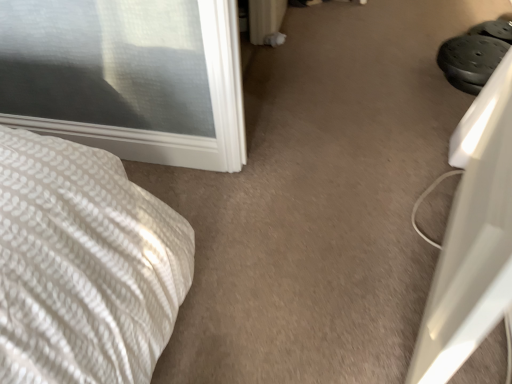
The width and height of the screenshot is (512, 384). Describe the element at coordinates (473, 240) in the screenshot. I see `white glossy screen door at right` at that location.

This screenshot has height=384, width=512. What are the coordinates of `white glossy screen door at right` in the screenshot? It's located at click(x=473, y=240).

Locate an element on the screen. white glossy screen door at right is located at coordinates (473, 240).